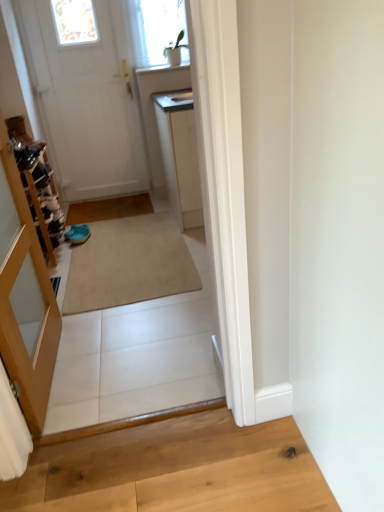
Question: Could you tell me if white matte door at upper left is turned towards beige carpet at center?

Choices:
 (A) yes
 (B) no

Answer: (A)

Question: Is beige carpet at center located within white matte door at upper left?

Choices:
 (A) yes
 (B) no

Answer: (B)

Question: Is white matte door at upper left positioned before beige carpet at center?

Choices:
 (A) no
 (B) yes

Answer: (A)

Question: Is white matte door at upper left wider than beige carpet at center?

Choices:
 (A) no
 (B) yes

Answer: (A)

Question: Does white matte door at upper left have a lesser width compared to beige carpet at center?

Choices:
 (A) no
 (B) yes

Answer: (B)

Question: From a real-world perspective, relative to white matte door at upper left, is beige carpet at center vertically above or below?

Choices:
 (A) below
 (B) above

Answer: (A)

Question: Considering the positions of beige carpet at center and white matte door at upper left in the image, is beige carpet at center wider or thinner than white matte door at upper left?

Choices:
 (A) wide
 (B) thin

Answer: (A)

Question: Considering the positions of beige carpet at center and white matte door at upper left in the image, is beige carpet at center taller or shorter than white matte door at upper left?

Choices:
 (A) tall
 (B) short

Answer: (B)

Question: Is beige carpet at center situated inside white matte door at upper left or outside?

Choices:
 (A) inside
 (B) outside

Answer: (B)

Question: Is white matte door at upper left situated inside light brown wood at lower right or outside?

Choices:
 (A) outside
 (B) inside

Answer: (A)

Question: From the image's perspective, relative to light brown wood at lower right, is white matte door at upper left above or below?

Choices:
 (A) below
 (B) above

Answer: (B)

Question: Relative to light brown wood at lower right, is white matte door at upper left in front or behind?

Choices:
 (A) behind
 (B) front

Answer: (A)

Question: Is point (52, 74) closer or farther from the camera than point (140, 480)?

Choices:
 (A) farther
 (B) closer

Answer: (A)

Question: Does point (115, 54) appear closer or farther from the camera than point (102, 381)?

Choices:
 (A) farther
 (B) closer

Answer: (A)

Question: Would you say white matte door at upper left is to the left or to the right of beige carpet at center in the picture?

Choices:
 (A) left
 (B) right

Answer: (A)